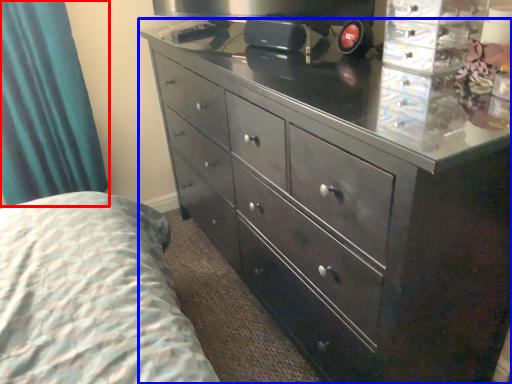
Question: Which of the following is the closest to the observer, curtain (highlighted by a red box) or chest of drawers (highlighted by a blue box)?

Choices:
 (A) curtain
 (B) chest of drawers

Answer: (B)